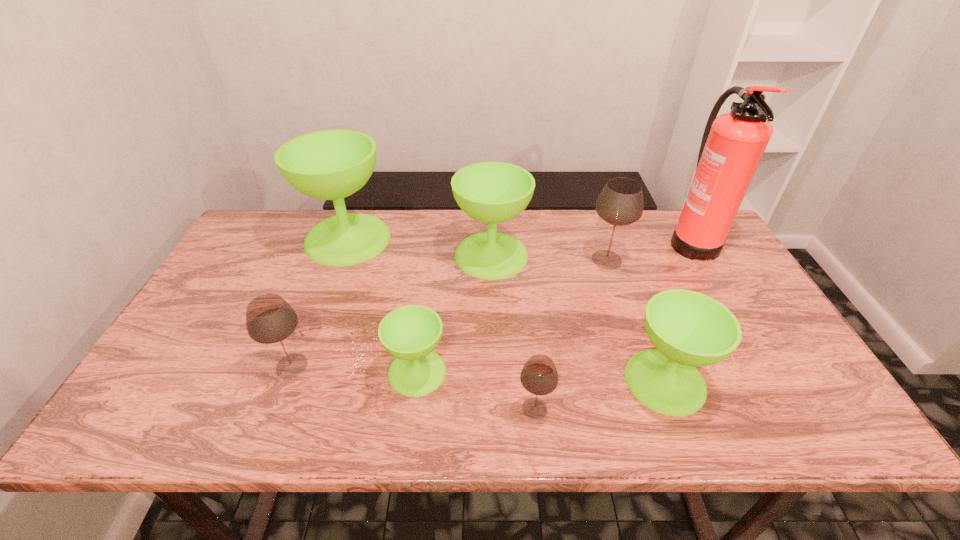
The height and width of the screenshot is (540, 960). In the image, there is a desktop. Identify the location of vacant region at the far left corner. click(x=276, y=244).

You are a GUI agent. You are given a task and a screenshot of the screen. Output one action in this format:
    pyautogui.click(x=<x>, y=<y>)
    Task: Click on the vacant area at the near left corner
    
    Given the screenshot: What is the action you would take?
    tap(181, 403)

Image resolution: width=960 pixels, height=540 pixels. What are the coordinates of `vacant space that is in between the third smallest green wineglass and the leftmost gray wineglass` in the screenshot? It's located at (392, 310).

Where is `empty space that is in between the leftmost gray wineglass and the rightmost object`? empty space that is in between the leftmost gray wineglass and the rightmost object is located at coordinates (492, 303).

This screenshot has width=960, height=540. I want to click on empty space that is in between the second biggest green wineglass and the third biggest green wineglass, so click(578, 318).

Where is `vacant region between the leftmost gray wineglass and the second green wineglass from right to left`? The image size is (960, 540). vacant region between the leftmost gray wineglass and the second green wineglass from right to left is located at coordinates (392, 310).

Locate an element on the screen. free area in between the second biggest green wineglass and the tallest object is located at coordinates (591, 247).

This screenshot has width=960, height=540. Identify the location of empty space between the third wineglass from left to right and the nearest gray wineglass. (476, 390).

At what (x,y) coordinates should I click in order to perform the action: click on vacant area that lies between the second biggest gray wineglass and the second smallest green wineglass. Please return your answer as a coordinate pair (x, y). Looking at the image, I should click on (478, 373).

At what (x,y) coordinates should I click in order to perform the action: click on object that is the fifth closest to the smallest gray wineglass. Please return your answer as a coordinate pair (x, y). This screenshot has height=540, width=960. Looking at the image, I should click on (270, 319).